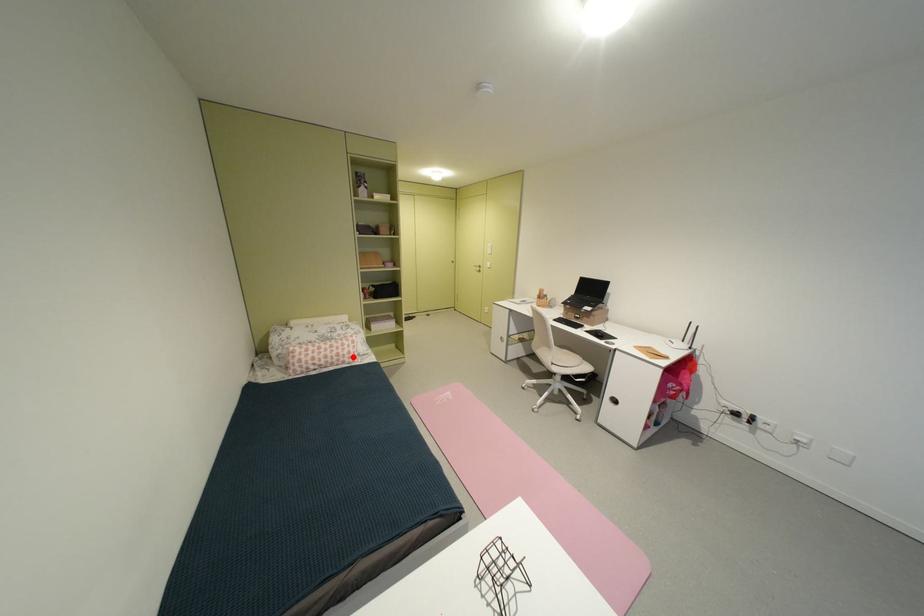
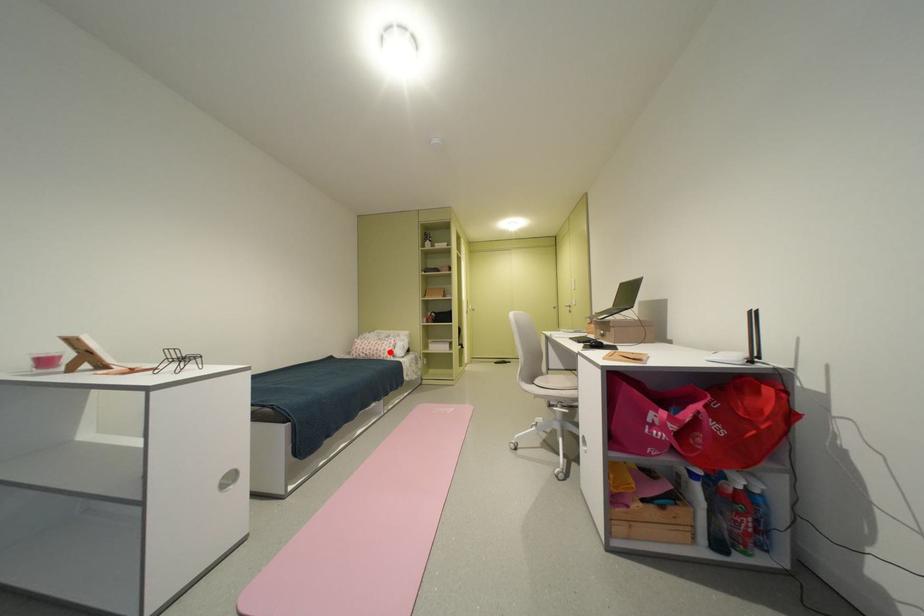
I am providing you with two images of the same scene from different viewpoints. A red point is marked on the first image and another point is marked on the second image. Do the highlighted points in image1 and image2 indicate the same real-world spot?

Yes